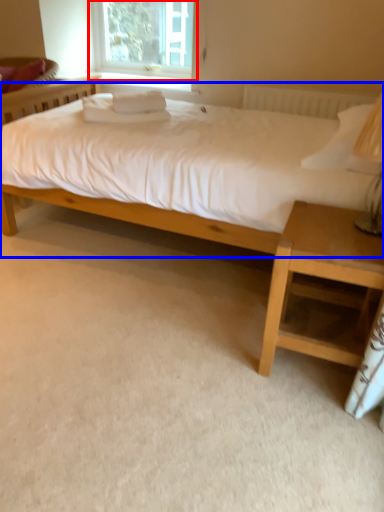
Question: Which object is further to the camera taking this photo, window (highlighted by a red box) or bed (highlighted by a blue box)?

Choices:
 (A) window
 (B) bed

Answer: (A)